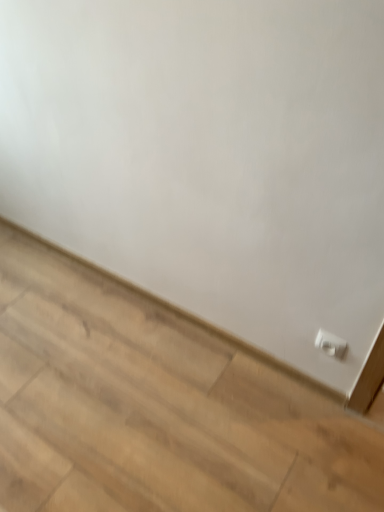
What do you see at coordinates (330, 344) in the screenshot?
I see `white plastic power plug at lower right` at bounding box center [330, 344].

You are a GUI agent. You are given a task and a screenshot of the screen. Output one action in this format:
    pyautogui.click(x=<x>, y=<y>)
    Task: Click on the white plastic power plug at lower right
    The height and width of the screenshot is (512, 384).
    Given the screenshot: What is the action you would take?
    pyautogui.click(x=330, y=344)

Measure the distance between white plastic power plug at lower right and camera.

The depth of white plastic power plug at lower right is 1.27 meters.

In order to click on white plastic power plug at lower right in this screenshot , I will do `click(330, 344)`.